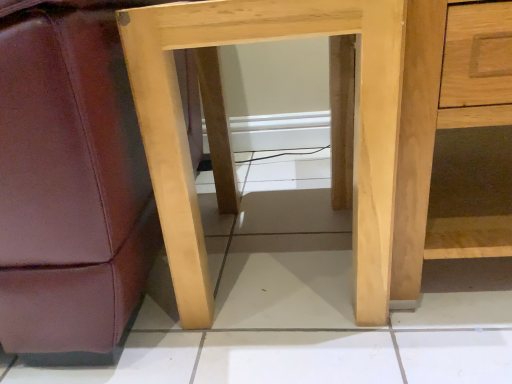
This screenshot has height=384, width=512. What are the coordinates of `free space underneath natural wood table at center (from a real-world perspective)` in the screenshot? It's located at (286, 251).